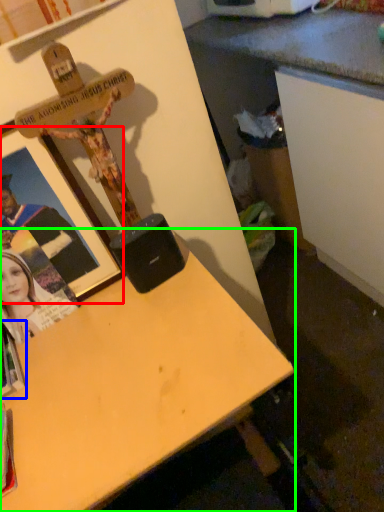
Question: Estimate the real-world distances between objects in this image. Which object is closer to picture frame (highlighted by a red box), book (highlighted by a blue box) or desk (highlighted by a green box)?

Choices:
 (A) book
 (B) desk

Answer: (B)